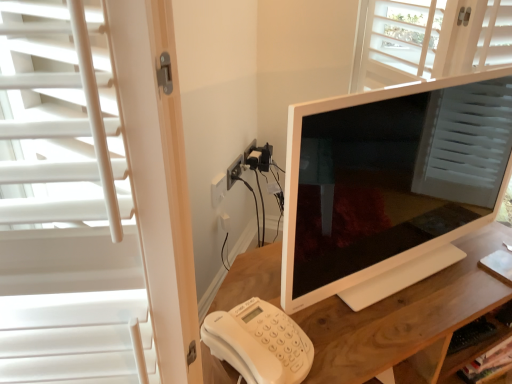
Question: Is white glossy monitor at center next to white plastic phone at lower left and touching it?

Choices:
 (A) yes
 (B) no

Answer: (B)

Question: Is white glossy monitor at center aimed at white plastic phone at lower left?

Choices:
 (A) no
 (B) yes

Answer: (A)

Question: Can you confirm if white glossy monitor at center is positioned to the left of white plastic phone at lower left?

Choices:
 (A) no
 (B) yes

Answer: (A)

Question: From the image's perspective, is white glossy monitor at center above white plastic phone at lower left?

Choices:
 (A) no
 (B) yes

Answer: (B)

Question: Is white glossy monitor at center smaller than white plastic phone at lower left?

Choices:
 (A) no
 (B) yes

Answer: (A)

Question: From the image's perspective, is white plastic phone at lower left located above or below wooden shelf at lower right?

Choices:
 (A) below
 (B) above

Answer: (B)

Question: Choose the correct answer: Is white plastic phone at lower left inside wooden shelf at lower right or outside it?

Choices:
 (A) outside
 (B) inside

Answer: (A)

Question: Looking at their shapes, would you say white plastic phone at lower left is wider or thinner than wooden shelf at lower right?

Choices:
 (A) thin
 (B) wide

Answer: (B)

Question: In the image, is white plastic phone at lower left positioned in front of or behind wooden shelf at lower right?

Choices:
 (A) behind
 (B) front

Answer: (B)

Question: From the image's perspective, is wooden shelf at lower right located above or below wooden desk at center?

Choices:
 (A) above
 (B) below

Answer: (B)

Question: Considering the positions of wooden shelf at lower right and wooden desk at center in the image, is wooden shelf at lower right bigger or smaller than wooden desk at center?

Choices:
 (A) big
 (B) small

Answer: (B)

Question: Considering the positions of wooden shelf at lower right and wooden desk at center in the image, is wooden shelf at lower right taller or shorter than wooden desk at center?

Choices:
 (A) short
 (B) tall

Answer: (A)

Question: Considering their positions, is wooden shelf at lower right located in front of or behind wooden desk at center?

Choices:
 (A) behind
 (B) front

Answer: (A)

Question: Is white glossy monitor at center in front of or behind wooden shelf at lower right in the image?

Choices:
 (A) front
 (B) behind

Answer: (A)

Question: From a real-world perspective, is white glossy monitor at center positioned above or below wooden shelf at lower right?

Choices:
 (A) below
 (B) above

Answer: (B)